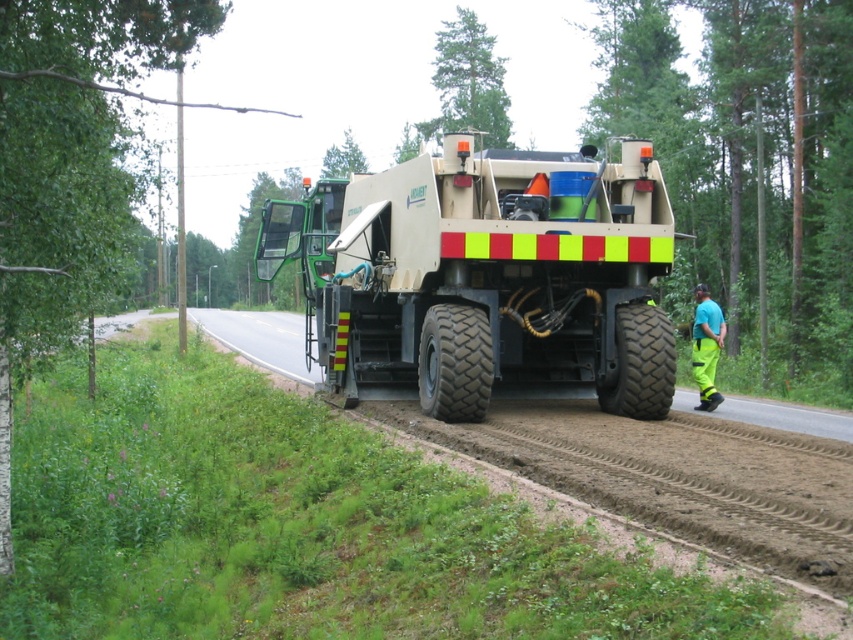
Is point (482, 344) positioned before point (706, 355)?

Yes, it is.

What do you see at coordinates (454, 362) in the screenshot? I see `black rubber tire at center` at bounding box center [454, 362].

At what (x,y) coordinates should I click in order to perform the action: click on black rubber tire at center. Please return your answer as a coordinate pair (x, y). Looking at the image, I should click on (454, 362).

Measure the distance between beige rubber garbage truck at center and camera.

beige rubber garbage truck at center is 11.23 meters away from camera.

Does point (537, 364) come behind point (621, 310)?

Yes.

This screenshot has height=640, width=853. In order to click on beige rubber garbage truck at center in this screenshot , I will do `click(485, 280)`.

The width and height of the screenshot is (853, 640). What do you see at coordinates (485, 280) in the screenshot?
I see `beige rubber garbage truck at center` at bounding box center [485, 280].

This screenshot has height=640, width=853. I want to click on beige rubber garbage truck at center, so click(485, 280).